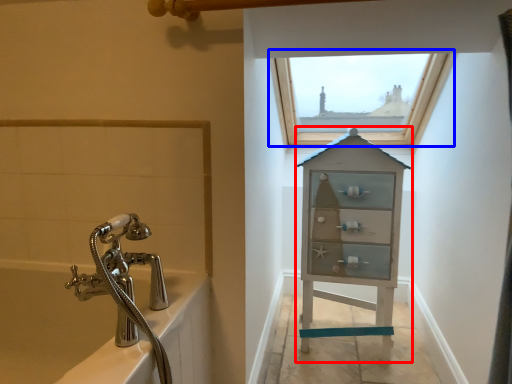
Question: Which object appears closest to the camera in this image, medicine cabinet (highlighted by a red box) or window (highlighted by a blue box)?

Choices:
 (A) medicine cabinet
 (B) window

Answer: (A)